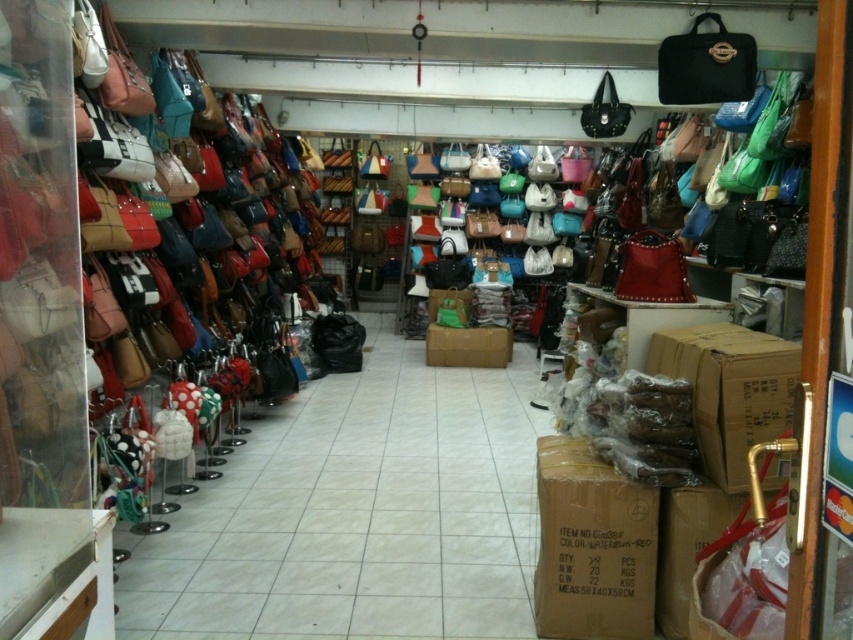
Is waterproof cardboard box at center wider than waterproof-red cardboard box at lower right?

Yes, waterproof cardboard box at center is wider than waterproof-red cardboard box at lower right.

Can you confirm if waterproof cardboard box at center is positioned to the right of waterproof-red cardboard box at lower right?

In fact, waterproof cardboard box at center is to the left of waterproof-red cardboard box at lower right.

You are a GUI agent. You are given a task and a screenshot of the screen. Output one action in this format:
    pyautogui.click(x=<x>, y=<y>)
    Task: Click on the waterproof cardboard box at center
    
    Given the screenshot: What is the action you would take?
    pyautogui.click(x=592, y=547)

Where is `waterproof cardboard box at center`? waterproof cardboard box at center is located at coordinates (592, 547).

This screenshot has height=640, width=853. Find the location of `waterproof cardboard box at center`. waterproof cardboard box at center is located at coordinates (592, 547).

Which is in front, point (566, 512) or point (683, 371)?

Positioned in front is point (566, 512).

This screenshot has width=853, height=640. Identify the location of waterproof cardboard box at center. (592, 547).

You are a GUI agent. You are given a task and a screenshot of the screen. Output one action in this format:
    pyautogui.click(x=<x>, y=<y>)
    Task: Click on the waterproof cardboard box at center
    
    Given the screenshot: What is the action you would take?
    pyautogui.click(x=592, y=547)

Between waterproof cardboard box at center and brown cardboard box at center, which one appears on the right side from the viewer's perspective?

waterproof cardboard box at center is more to the right.

Between point (646, 602) and point (445, 362), which one is positioned in front?

Point (646, 602) is in front.

Who is more forward, (646, 490) or (495, 342)?

Point (646, 490) is more forward.

At what (x,y) coordinates should I click in order to perform the action: click on waterproof cardboard box at center. Please return your answer as a coordinate pair (x, y). This screenshot has width=853, height=640. Looking at the image, I should click on (592, 547).